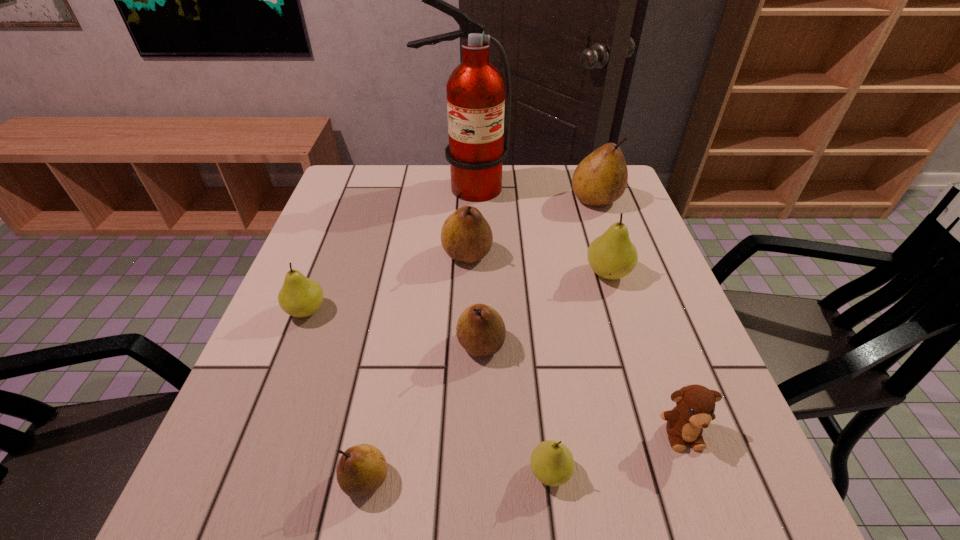
Locate an element on the screen. free space located 0.050m on the face of the teddy bear is located at coordinates (700, 484).

At what (x,y) coordinates should I click in order to perform the action: click on free space located 0.280m on the back of the smallest brown pear. Please return your answer as a coordinate pair (x, y). The width and height of the screenshot is (960, 540). Looking at the image, I should click on (395, 325).

Locate an element on the screen. vacant space situated 0.210m on the left of the third pear from right to left is located at coordinates (396, 472).

Where is `fire extinguisher that is at the far edge`? This screenshot has height=540, width=960. fire extinguisher that is at the far edge is located at coordinates (475, 90).

Where is `pear at the far edge`? The height and width of the screenshot is (540, 960). pear at the far edge is located at coordinates (601, 178).

Identify the location of object that is at the left edge. (299, 296).

Locate an element on the screen. Image resolution: width=960 pixels, height=540 pixels. teddy bear present at the right edge is located at coordinates 695,408.

In order to click on object located at the far right corner in this screenshot , I will do point(601,178).

Locate an element on the screen. free location at the far edge of the desktop is located at coordinates (548, 204).

The width and height of the screenshot is (960, 540). Identify the location of free space at the near edge. (330, 493).